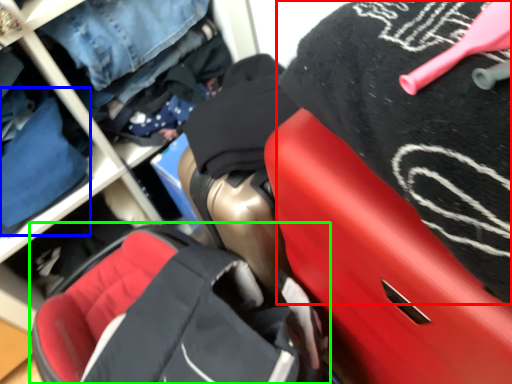
Question: Which object is positioned farthest from clothing (highlighted by a red box)? Select from clothing (highlighted by a blue box) and baby carriage (highlighted by a green box).

Choices:
 (A) clothing
 (B) baby carriage

Answer: (A)